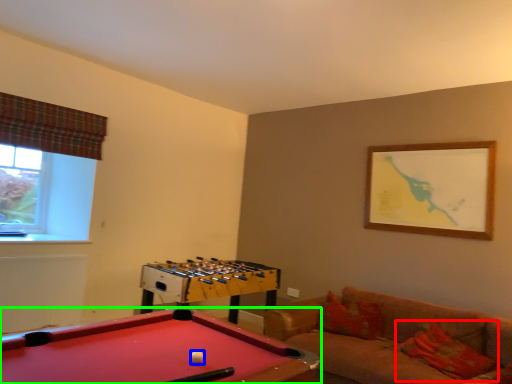
Question: Which object is the farthest from pillow (highlighted by a red box)? Choose among these: ball (highlighted by a blue box) or billiard table (highlighted by a green box).

Choices:
 (A) ball
 (B) billiard table

Answer: (A)